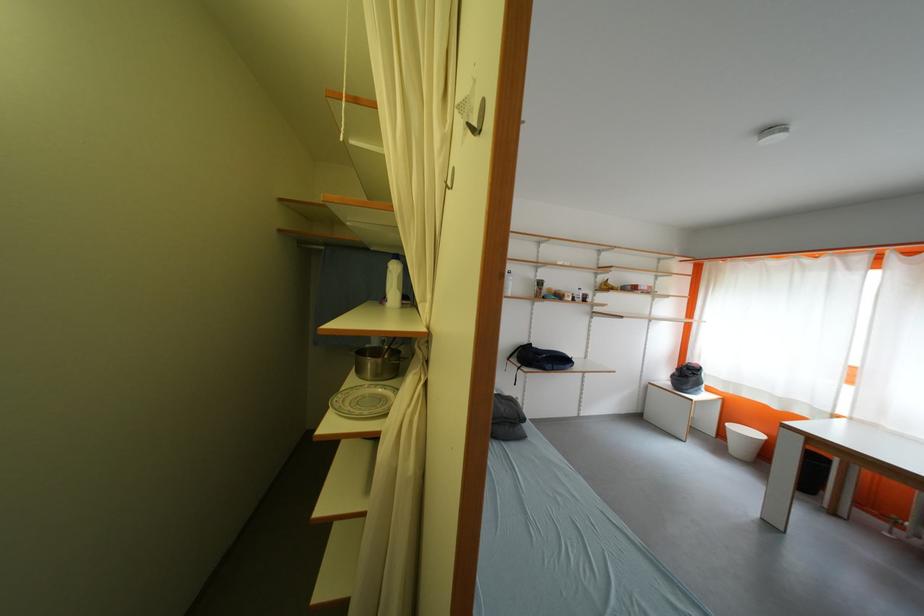
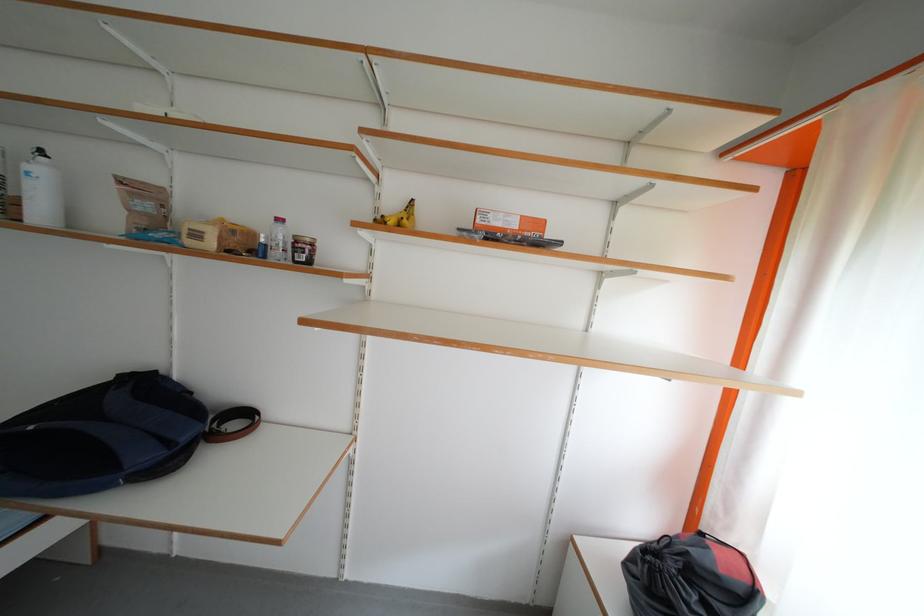
Based on the photo, in a continuous first-person perspective shot, in which direction is the camera moving?

The cameraman walked toward right, forward.